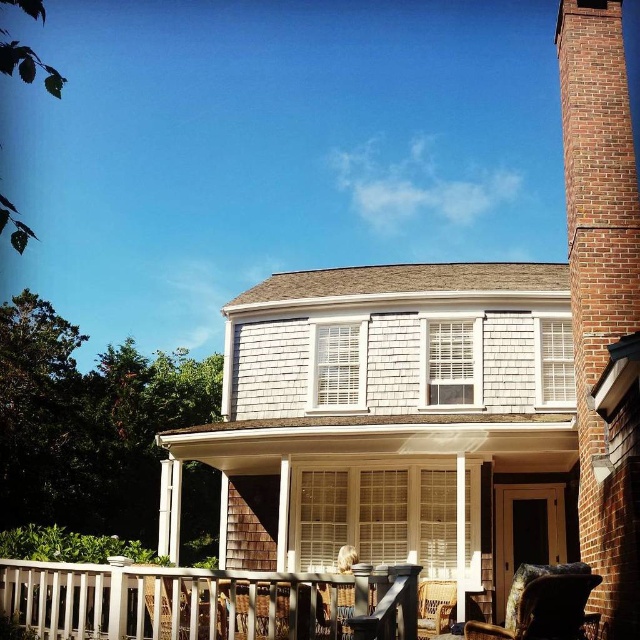
You are planning to place a large potted plant between the leather textured chair at lower right and the wooden wicker chair at lower right on the porch. Based on their sizes, which chair should the plant be closer to?

The leather textured chair at lower right is bigger than the wooden wicker chair at lower right, so the plant should be placed closer to the leather textured chair at lower right to maintain balance.

Based on the photo, you are standing in front of the house and want to move from the white wood porch at lower center to the leather textured chair at lower right. Which direction should you walk to reach the chair?

You should walk to the right to reach the leather textured chair at lower right because the white wood porch at lower center is to the left of it.